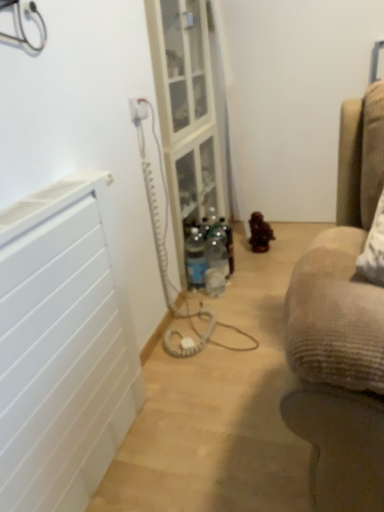
You are a GUI agent. You are given a task and a screenshot of the screen. Output one action in this format:
    pyautogui.click(x=<x>, y=<y>)
    Task: Click on the free space in front of clear plastic bottle at center
    The width and height of the screenshot is (384, 512).
    Given the screenshot: What is the action you would take?
    (x=210, y=303)